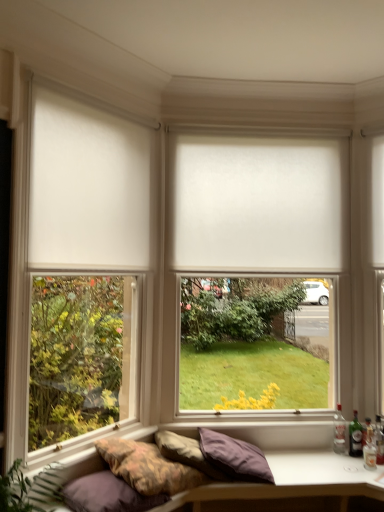
Question: Is clear glass bottle at lower right, which is counted as the fourth bottle, starting from the right, placed right next to white matte window frame at upper left?

Choices:
 (A) yes
 (B) no

Answer: (B)

Question: Is clear glass bottle at lower right, which is counted as the fourth bottle, starting from the right, surrounding white matte window frame at upper left?

Choices:
 (A) yes
 (B) no

Answer: (B)

Question: Is clear glass bottle at lower right, which is counted as the fourth bottle, starting from the right, behind white matte window frame at upper left?

Choices:
 (A) yes
 (B) no

Answer: (A)

Question: Is clear glass bottle at lower right, placed as the first bottle when sorted from left to right, shorter than white matte window frame at upper left?

Choices:
 (A) no
 (B) yes

Answer: (B)

Question: Is clear glass bottle at lower right, placed as the first bottle when sorted from left to right, not within white matte window frame at upper left?

Choices:
 (A) no
 (B) yes

Answer: (B)

Question: From the image's perspective, is translucent glass bottle at right, the 4th bottle from the left, located above or below white matte window blind at center?

Choices:
 (A) above
 (B) below

Answer: (B)

Question: In terms of height, does translucent glass bottle at right, the 4th bottle from the left, look taller or shorter compared to white matte window blind at center?

Choices:
 (A) tall
 (B) short

Answer: (B)

Question: Considering the positions of point (374, 434) and point (210, 178), is point (374, 434) closer or farther from the camera than point (210, 178)?

Choices:
 (A) closer
 (B) farther

Answer: (A)

Question: Considering their positions, is translucent glass bottle at right, the 4th bottle from the left, located in front of or behind white matte window blind at center?

Choices:
 (A) front
 (B) behind

Answer: (A)

Question: From the image's perspective, relative to purple fabric pillow at lower center, positioned as the first pillow in right-to-left order, is textured fabric studio couch at lower center above or below?

Choices:
 (A) below
 (B) above

Answer: (A)

Question: In the image, is textured fabric studio couch at lower center positioned in front of or behind purple fabric pillow at lower center, acting as the 3th pillow starting from the left?

Choices:
 (A) front
 (B) behind

Answer: (A)

Question: Is textured fabric studio couch at lower center wider or thinner than purple fabric pillow at lower center, positioned as the first pillow in right-to-left order?

Choices:
 (A) wide
 (B) thin

Answer: (A)

Question: Looking at the image, does textured fabric studio couch at lower center seem bigger or smaller compared to purple fabric pillow at lower center, positioned as the first pillow in right-to-left order?

Choices:
 (A) big
 (B) small

Answer: (A)

Question: Is point (334, 433) positioned closer to the camera than point (110, 268)?

Choices:
 (A) closer
 (B) farther

Answer: (B)

Question: Is clear glass bottle at lower right, placed as the first bottle when sorted from left to right, in front of or behind white matte curtain at left in the image?

Choices:
 (A) behind
 (B) front

Answer: (A)